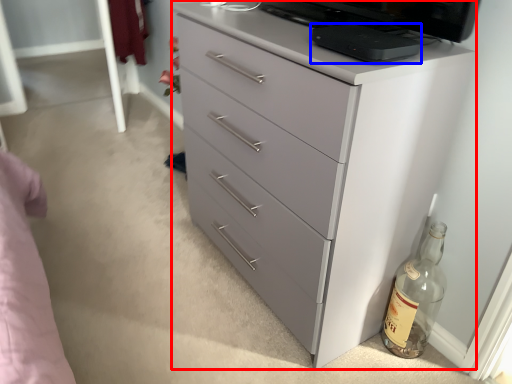
Question: Which point is further to the camera, chest of drawers (highlighted by a red box) or appliance (highlighted by a blue box)?

Choices:
 (A) chest of drawers
 (B) appliance

Answer: (B)